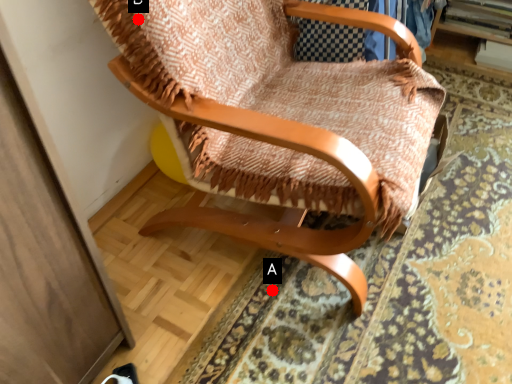
Question: Two points are circled on the image, labeled by A and B beside each circle. Which point is farther from the camera taking this photo?

Choices:
 (A) A is further
 (B) B is further

Answer: (A)